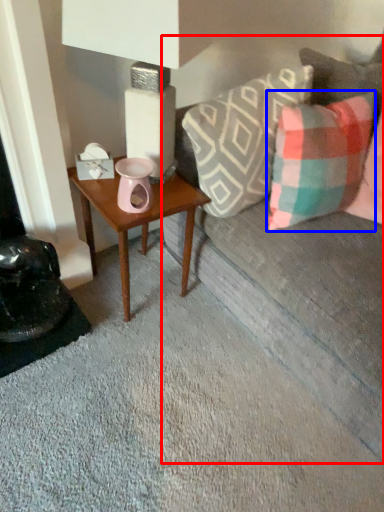
Question: Which object is closer to the camera taking this photo, studio couch (highlighted by a red box) or pillow (highlighted by a blue box)?

Choices:
 (A) studio couch
 (B) pillow

Answer: (A)